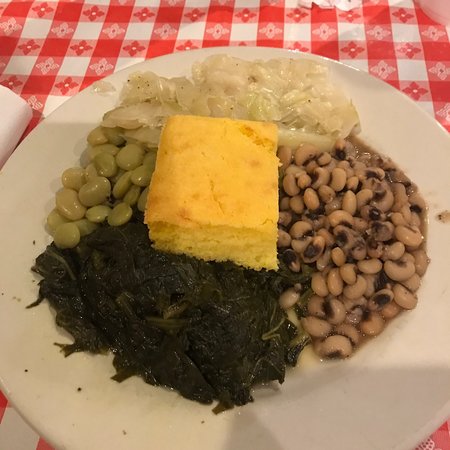
Locate an element on the screen. checkered tablecloth is located at coordinates (119, 34), (371, 30), (442, 442), (13, 438).